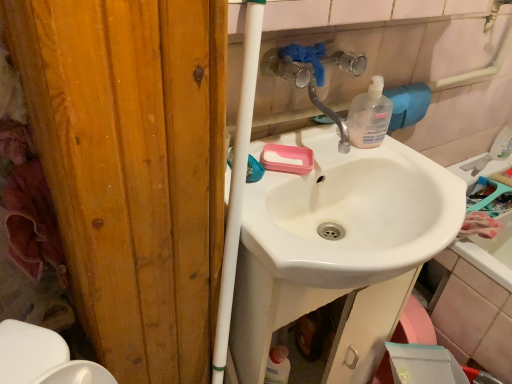
I want to click on space that is in front of pink matte soap at center, so [x=274, y=188].